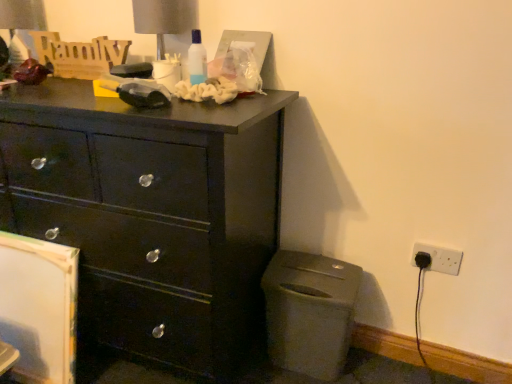
Describe the element at coordinates (426, 253) in the screenshot. I see `black plastic electric outlet at lower right, which is the 1th electric outlet in left-to-right order` at that location.

Identify the location of black plastic electric outlet at lower right, which is the 1th electric outlet in left-to-right order. (426, 253).

The height and width of the screenshot is (384, 512). What do you see at coordinates (163, 19) in the screenshot? I see `metallic gray table lamp at upper center` at bounding box center [163, 19].

The height and width of the screenshot is (384, 512). Identify the location of matte black chest of drawers at left. (151, 214).

What is the approximate height of matte black chest of drawers at left?

37.34 inches.

This screenshot has height=384, width=512. I want to click on white plastic electrical outlet at lower right, which is the 2th electric outlet in left-to-right order, so click(x=440, y=258).

In the scene shown: What is the approximate width of matte plastic trash can at lower right?

It is 8.13 inches.

Locate an element on the screen. This screenshot has width=512, height=384. black plastic electric outlet at lower right, which is the 1th electric outlet in left-to-right order is located at coordinates (426, 253).

Is matte plastic trash can at lower right next to black plastic electric outlet at lower right, the second electric outlet when ordered from right to left?

matte plastic trash can at lower right and black plastic electric outlet at lower right, the second electric outlet when ordered from right to left, are clearly separated.

From the image's perspective, is matte plastic trash can at lower right located above or below black plastic electric outlet at lower right, which is the 1th electric outlet in left-to-right order?

Based on their image positions, matte plastic trash can at lower right is located beneath black plastic electric outlet at lower right, which is the 1th electric outlet in left-to-right order.

Which object is thinner, matte plastic trash can at lower right or black plastic electric outlet at lower right, the second electric outlet when ordered from right to left?

With smaller width is black plastic electric outlet at lower right, the second electric outlet when ordered from right to left.

From the image's perspective, between matte black chest of drawers at left and white plastic electrical outlet at lower right, which is counted as the first electric outlet, starting from the right, who is located below?

white plastic electrical outlet at lower right, which is counted as the first electric outlet, starting from the right, appears lower in the image.

Would you say matte black chest of drawers at left is inside or outside white plastic electrical outlet at lower right, which is counted as the first electric outlet, starting from the right?

The correct answer is: outside.

Measure the distance between matte black chest of drawers at left and white plastic electrical outlet at lower right, which is the 2th electric outlet in left-to-right order.

They are 35.41 inches apart.

Is matte black chest of drawers at left positioned far away from white plastic electrical outlet at lower right, which is the 2th electric outlet in left-to-right order?

Actually, matte black chest of drawers at left and white plastic electrical outlet at lower right, which is the 2th electric outlet in left-to-right order, are a little close together.

Is matte black chest of drawers at left not inside black plastic electric outlet at lower right, which is the 1th electric outlet in left-to-right order?

Yes.

Are matte black chest of drawers at left and black plastic electric outlet at lower right, the second electric outlet when ordered from right to left, located far from each other?

No, matte black chest of drawers at left is in close proximity to black plastic electric outlet at lower right, the second electric outlet when ordered from right to left.

Considering the relative positions of matte black chest of drawers at left and black plastic electric outlet at lower right, which is the 1th electric outlet in left-to-right order, in the image provided, is matte black chest of drawers at left to the left of black plastic electric outlet at lower right, which is the 1th electric outlet in left-to-right order, from the viewer's perspective?

Correct, you'll find matte black chest of drawers at left to the left of black plastic electric outlet at lower right, which is the 1th electric outlet in left-to-right order.

From a real-world perspective, is matte black chest of drawers at left positioned under black plastic electric outlet at lower right, the second electric outlet when ordered from right to left, based on gravity?

No, from a real-world perspective, matte black chest of drawers at left is not under black plastic electric outlet at lower right, the second electric outlet when ordered from right to left.

Are black plastic electric outlet at lower right, the second electric outlet when ordered from right to left, and metallic gray table lamp at upper center located far from each other?

black plastic electric outlet at lower right, the second electric outlet when ordered from right to left, is positioned a significant distance from metallic gray table lamp at upper center.

Does point (436, 246) come in front of point (144, 0)?

Yes, point (436, 246) is closer to viewer.

Would you say black plastic electric outlet at lower right, the second electric outlet when ordered from right to left, is outside metallic gray table lamp at upper center?

Absolutely, black plastic electric outlet at lower right, the second electric outlet when ordered from right to left, is external to metallic gray table lamp at upper center.

Is black plastic electric outlet at lower right, which is the 1th electric outlet in left-to-right order, smaller than metallic gray table lamp at upper center?

Yes, black plastic electric outlet at lower right, which is the 1th electric outlet in left-to-right order, is smaller than metallic gray table lamp at upper center.

Is metallic gray table lamp at upper center aimed at white plastic electrical outlet at lower right, which is counted as the first electric outlet, starting from the right?

No, metallic gray table lamp at upper center is not aimed at white plastic electrical outlet at lower right, which is counted as the first electric outlet, starting from the right.

Is metallic gray table lamp at upper center to the left of white plastic electrical outlet at lower right, which is counted as the first electric outlet, starting from the right, from the viewer's perspective?

Correct, you'll find metallic gray table lamp at upper center to the left of white plastic electrical outlet at lower right, which is counted as the first electric outlet, starting from the right.

Is point (177, 33) in front of point (452, 264)?

No, (177, 33) is behind (452, 264).

Looking at their sizes, would you say metallic gray table lamp at upper center is wider or thinner than white plastic electrical outlet at lower right, which is the 2th electric outlet in left-to-right order?

Clearly, metallic gray table lamp at upper center has more width compared to white plastic electrical outlet at lower right, which is the 2th electric outlet in left-to-right order.

Which of these two, black plastic electric outlet at lower right, which is the 1th electric outlet in left-to-right order, or matte black chest of drawers at left, stands taller?

matte black chest of drawers at left.

Based on the photo, from the image's perspective, is black plastic electric outlet at lower right, which is the 1th electric outlet in left-to-right order, on matte black chest of drawers at left?

Actually, black plastic electric outlet at lower right, which is the 1th electric outlet in left-to-right order, appears below matte black chest of drawers at left in the image.

From a real-world perspective, is black plastic electric outlet at lower right, the second electric outlet when ordered from right to left, located higher than matte black chest of drawers at left?

No, from a real-world perspective, black plastic electric outlet at lower right, the second electric outlet when ordered from right to left, is not over matte black chest of drawers at left

Considering the relative positions of black plastic electric outlet at lower right, the second electric outlet when ordered from right to left, and matte black chest of drawers at left in the image provided, is black plastic electric outlet at lower right, the second electric outlet when ordered from right to left, to the left of matte black chest of drawers at left from the viewer's perspective?

Incorrect, black plastic electric outlet at lower right, the second electric outlet when ordered from right to left, is not on the left side of matte black chest of drawers at left.

Considering the sizes of objects white plastic electrical outlet at lower right, which is the 2th electric outlet in left-to-right order, and matte black chest of drawers at left in the image provided, who is taller, white plastic electrical outlet at lower right, which is the 2th electric outlet in left-to-right order, or matte black chest of drawers at left?

matte black chest of drawers at left.

Between white plastic electrical outlet at lower right, which is counted as the first electric outlet, starting from the right, and matte black chest of drawers at left, which one is positioned behind?

white plastic electrical outlet at lower right, which is counted as the first electric outlet, starting from the right, is further from the camera.

This screenshot has height=384, width=512. I want to click on the 1st electric outlet located beneath the matte black chest of drawers at left (from a real-world perspective), so click(x=440, y=258).

Is white plastic electrical outlet at lower right, which is counted as the first electric outlet, starting from the right, oriented away from matte black chest of drawers at left?

white plastic electrical outlet at lower right, which is counted as the first electric outlet, starting from the right, does not have its back to matte black chest of drawers at left.

Locate an element on the screen. This screenshot has height=384, width=512. cabinetry lying on the left of black plastic electric outlet at lower right, which is the 1th electric outlet in left-to-right order is located at coordinates (310, 312).

Identify the location of the chest of drawers above the white plastic electrical outlet at lower right, which is counted as the first electric outlet, starting from the right (from a real-world perspective). (151, 214).

Looking at the image, which one is located closer to matte plastic trash can at lower right, matte black chest of drawers at left or black plastic electric outlet at lower right, the second electric outlet when ordered from right to left?

matte black chest of drawers at left lies closer to matte plastic trash can at lower right than the other object.

From the image, which object appears to be nearer to black plastic electric outlet at lower right, which is the 1th electric outlet in left-to-right order, white plastic electrical outlet at lower right, which is the 2th electric outlet in left-to-right order, or metallic gray table lamp at upper center?

white plastic electrical outlet at lower right, which is the 2th electric outlet in left-to-right order.

Based on their spatial positions, is matte black chest of drawers at left or metallic gray table lamp at upper center further from white plastic electrical outlet at lower right, which is the 2th electric outlet in left-to-right order?

metallic gray table lamp at upper center is further to white plastic electrical outlet at lower right, which is the 2th electric outlet in left-to-right order.

From the image, which object appears to be farther from matte black chest of drawers at left, metallic gray table lamp at upper center or black plastic electric outlet at lower right, which is the 1th electric outlet in left-to-right order?

black plastic electric outlet at lower right, which is the 1th electric outlet in left-to-right order, lies further to matte black chest of drawers at left than the other object.

Estimate the real-world distances between objects in this image. Which object is further from white plastic electrical outlet at lower right, which is counted as the first electric outlet, starting from the right, metallic gray table lamp at upper center or black plastic electric outlet at lower right, which is the 1th electric outlet in left-to-right order?

Based on the image, metallic gray table lamp at upper center appears to be further to white plastic electrical outlet at lower right, which is counted as the first electric outlet, starting from the right.

Which object lies nearer to the anchor point black plastic electric outlet at lower right, which is the 1th electric outlet in left-to-right order, metallic gray table lamp at upper center or matte plastic trash can at lower right?

matte plastic trash can at lower right.

Which object lies further to the anchor point black plastic electric outlet at lower right, which is the 1th electric outlet in left-to-right order, matte plastic trash can at lower right or metallic gray table lamp at upper center?

metallic gray table lamp at upper center is positioned further to the anchor black plastic electric outlet at lower right, which is the 1th electric outlet in left-to-right order.

From the image, which object appears to be nearer to white plastic electrical outlet at lower right, which is counted as the first electric outlet, starting from the right, metallic gray table lamp at upper center or matte plastic trash can at lower right?

matte plastic trash can at lower right is closer to white plastic electrical outlet at lower right, which is counted as the first electric outlet, starting from the right.

Where is `electric outlet between matte plastic trash can at lower right and white plastic electrical outlet at lower right, which is the 2th electric outlet in left-to-right order`? electric outlet between matte plastic trash can at lower right and white plastic electrical outlet at lower right, which is the 2th electric outlet in left-to-right order is located at coordinates (426, 253).

The image size is (512, 384). Identify the location of cabinetry situated between matte black chest of drawers at left and white plastic electrical outlet at lower right, which is the 2th electric outlet in left-to-right order, from left to right. (310, 312).

You are a GUI agent. You are given a task and a screenshot of the screen. Output one action in this format:
    pyautogui.click(x=<x>, y=<y>)
    Task: Click on the cabinetry situated between matte black chest of drawers at left and black plastic electric outlet at lower right, the second electric outlet when ordered from right to left, from left to right
    The height and width of the screenshot is (384, 512).
    Given the screenshot: What is the action you would take?
    pyautogui.click(x=310, y=312)

Image resolution: width=512 pixels, height=384 pixels. I want to click on electric outlet between matte black chest of drawers at left and white plastic electrical outlet at lower right, which is counted as the first electric outlet, starting from the right, so click(x=426, y=253).